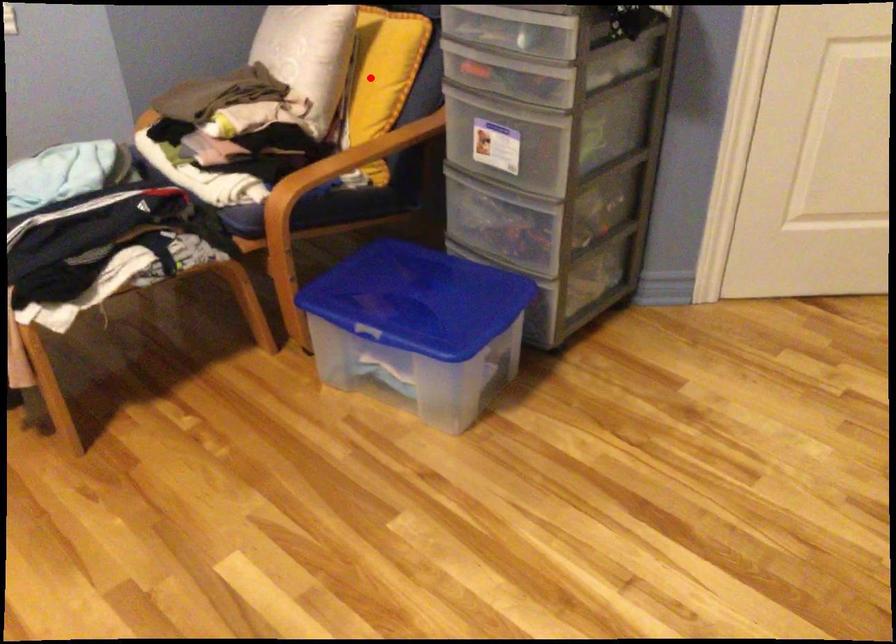
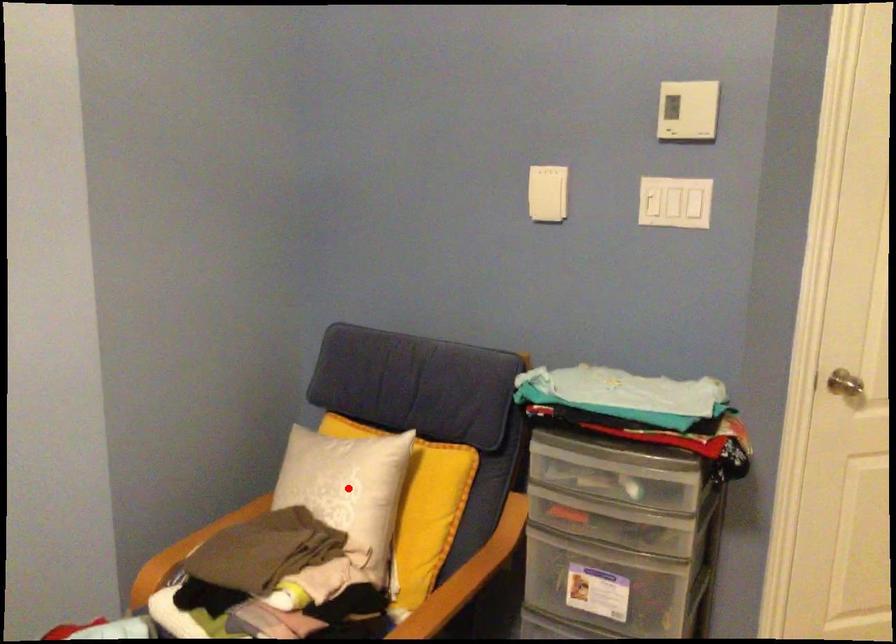
I am providing you with two images of the same scene from different viewpoints. A red point is marked on the first image and another point is marked on the second image. Do the highlighted points in image1 and image2 indicate the same real-world spot?

No